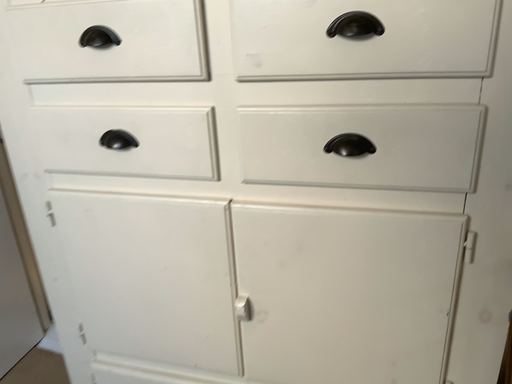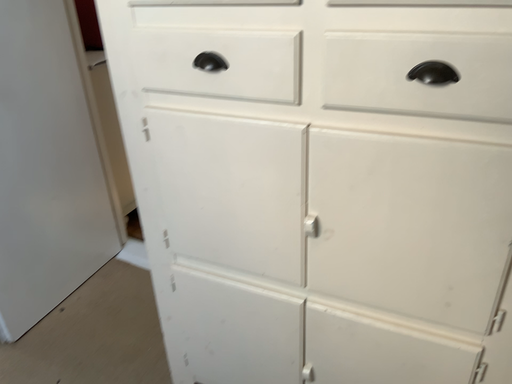
Question: Which way did the camera rotate in the video?

Choices:
 (A) rotated downward
 (B) rotated upward

Answer: (A)